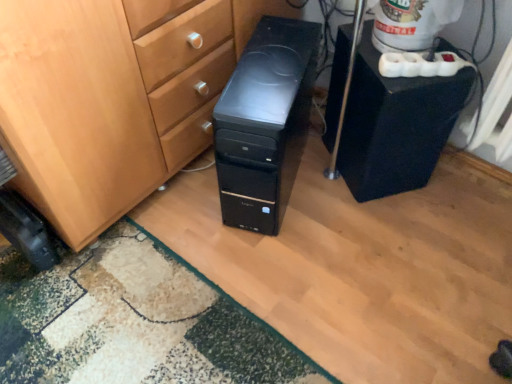
Question: Is black plastic speaker at right positioned behind black rubber wheel at lower left?

Choices:
 (A) no
 (B) yes

Answer: (A)

Question: From the image's perspective, is black plastic speaker at right over black rubber wheel at lower left?

Choices:
 (A) no
 (B) yes

Answer: (B)

Question: Is black plastic speaker at right surrounding black rubber wheel at lower left?

Choices:
 (A) no
 (B) yes

Answer: (A)

Question: Can you confirm if black plastic speaker at right is bigger than black rubber wheel at lower left?

Choices:
 (A) yes
 (B) no

Answer: (A)

Question: Is black plastic speaker at right next to black rubber wheel at lower left and touching it?

Choices:
 (A) no
 (B) yes

Answer: (A)

Question: Based on their positions, is black plastic speaker at right located to the left or right of green textured rug at lower left?

Choices:
 (A) left
 (B) right

Answer: (B)

Question: In the image, is black plastic speaker at right positioned in front of or behind green textured rug at lower left?

Choices:
 (A) front
 (B) behind

Answer: (B)

Question: Is black plastic speaker at right taller or shorter than green textured rug at lower left?

Choices:
 (A) tall
 (B) short

Answer: (A)

Question: In terms of size, does black plastic speaker at right appear bigger or smaller than green textured rug at lower left?

Choices:
 (A) small
 (B) big

Answer: (B)

Question: Considering the positions of green textured rug at lower left and black rubber wheel at lower left in the image, is green textured rug at lower left wider or thinner than black rubber wheel at lower left?

Choices:
 (A) thin
 (B) wide

Answer: (B)

Question: Is point (244, 312) positioned closer to the camera than point (4, 221)?

Choices:
 (A) closer
 (B) farther

Answer: (B)

Question: Is green textured rug at lower left in front of or behind black rubber wheel at lower left in the image?

Choices:
 (A) behind
 (B) front

Answer: (B)

Question: Is green textured rug at lower left to the left or to the right of black rubber wheel at lower left in the image?

Choices:
 (A) right
 (B) left

Answer: (A)

Question: In the image, is white plastic water cooler at upper right positioned in front of or behind black plastic computer tower at center?

Choices:
 (A) behind
 (B) front

Answer: (A)

Question: From a real-world perspective, is white plastic water cooler at upper right above or below black plastic computer tower at center?

Choices:
 (A) above
 (B) below

Answer: (A)